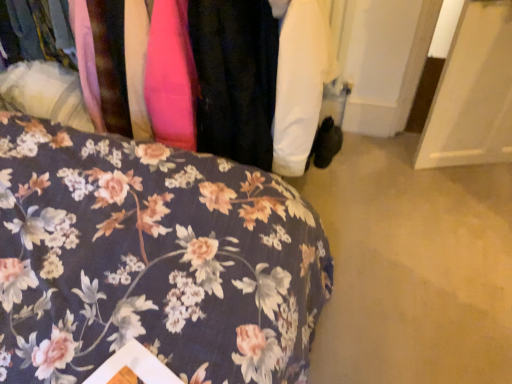
Question: Would you say floral fabric at center is to the left or to the right of floral fabric bedspread at lower left in the picture?

Choices:
 (A) left
 (B) right

Answer: (B)

Question: Is floral fabric at center situated inside floral fabric bedspread at lower left or outside?

Choices:
 (A) outside
 (B) inside

Answer: (A)

Question: Considering their positions, is floral fabric at center located in front of or behind floral fabric bedspread at lower left?

Choices:
 (A) front
 (B) behind

Answer: (B)

Question: In terms of size, does floral fabric bedspread at lower left appear bigger or smaller than floral fabric at center?

Choices:
 (A) big
 (B) small

Answer: (A)

Question: Is floral fabric bedspread at lower left to the left or to the right of floral fabric at center in the image?

Choices:
 (A) left
 (B) right

Answer: (A)

Question: Is floral fabric bedspread at lower left inside the boundaries of floral fabric at center, or outside?

Choices:
 (A) inside
 (B) outside

Answer: (B)

Question: Is point (183, 322) closer or farther from the camera than point (189, 86)?

Choices:
 (A) closer
 (B) farther

Answer: (A)